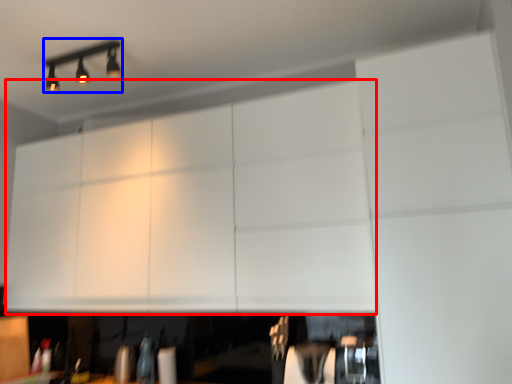
Question: Which object is further to the camera taking this photo, cabinetry (highlighted by a red box) or lamp (highlighted by a blue box)?

Choices:
 (A) cabinetry
 (B) lamp

Answer: (B)